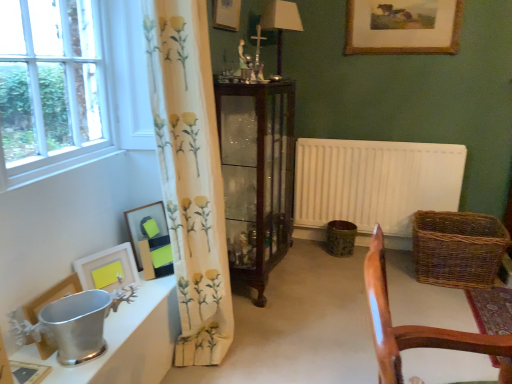
This screenshot has height=384, width=512. Describe the element at coordinates (51, 296) in the screenshot. I see `metallic silver picture frame at lower left, the fifth picture frame when ordered from right to left` at that location.

This screenshot has width=512, height=384. Find the location of `metallic silver picture frame at lower left, which is counted as the second picture frame, starting from the bottom`. metallic silver picture frame at lower left, which is counted as the second picture frame, starting from the bottom is located at coordinates (51, 296).

The height and width of the screenshot is (384, 512). What do you see at coordinates (127, 341) in the screenshot?
I see `polished silver bucket at lower left` at bounding box center [127, 341].

What is the approximate width of gold-framed painting at upper center, which is counted as the 6th picture frame, starting from the bottom?

It is 2.55 inches.

The width and height of the screenshot is (512, 384). What are the coordinates of `metallic silver picture frame at lower left, acting as the 5th picture frame starting from the top` in the screenshot? It's located at point(51,296).

Based on their positions, is brown woven basket at lower right located to the left or right of dark wood cabinet at center?

brown woven basket at lower right is to the right of dark wood cabinet at center.

Considering the points (485, 258) and (268, 217), which point is behind, point (485, 258) or point (268, 217)?

The point (485, 258) is behind.

Which object is thinner, brown woven basket at lower right or dark wood cabinet at center?

dark wood cabinet at center.

Is yellow floral fabric curtain at left a part of gold-framed painting at upper center, which is counted as the first picture frame, starting from the top?

Definitely not — yellow floral fabric curtain at left is not inside gold-framed painting at upper center, which is counted as the first picture frame, starting from the top.

Based on the photo, can you confirm if gold-framed painting at upper center, which is counted as the first picture frame, starting from the top, is smaller than yellow floral fabric curtain at left?

Yes.

What's the angular difference between gold-framed painting at upper center, placed as the 1th picture frame when sorted from right to left, and yellow floral fabric curtain at left's facing directions?

There is a 89.6-degree angle between the facing directions of gold-framed painting at upper center, placed as the 1th picture frame when sorted from right to left, and yellow floral fabric curtain at left.

Which is more distant, (425, 23) or (207, 256)?

Positioned behind is point (425, 23).

Consider the image. Is white matte radiator at center right further to the viewer compared to wooden chair at lower right?

Yes, white matte radiator at center right is further from the camera.

Considering the sizes of white matte radiator at center right and wooden chair at lower right in the image, is white matte radiator at center right taller or shorter than wooden chair at lower right?

white matte radiator at center right is taller than wooden chair at lower right.

In the scene shown: Would you say white matte radiator at center right is to the left or to the right of wooden chair at lower right in the picture?

Clearly, white matte radiator at center right is on the right of wooden chair at lower right in the image.

Considering the points (426, 175) and (369, 283), which point is in front, point (426, 175) or point (369, 283)?

The point (369, 283) is in front.

Where is `picture frame that is the 3rd one when counting leftward from the brown woven basket at lower right`? The image size is (512, 384). picture frame that is the 3rd one when counting leftward from the brown woven basket at lower right is located at coordinates (150, 240).

Which is in front, brown woven basket at lower right or matte black picture frame at lower left, which is the 3th picture frame from top to bottom?

Positioned in front is matte black picture frame at lower left, which is the 3th picture frame from top to bottom.

Does brown woven basket at lower right have a lesser width compared to matte black picture frame at lower left, which ranks as the 4th picture frame in bottom-to-top order?

Incorrect, the width of brown woven basket at lower right is not less than that of matte black picture frame at lower left, which ranks as the 4th picture frame in bottom-to-top order.

Considering the sizes of metallic silver picture frame at lower left, acting as the fifth picture frame starting from the back, and white matte radiator at center right in the image, is metallic silver picture frame at lower left, acting as the fifth picture frame starting from the back, taller or shorter than white matte radiator at center right?

In the image, metallic silver picture frame at lower left, acting as the fifth picture frame starting from the back, appears to be shorter than white matte radiator at center right.

Is metallic silver picture frame at lower left, arranged as the 2th picture frame when viewed from the front, beside white matte radiator at center right?

No, metallic silver picture frame at lower left, arranged as the 2th picture frame when viewed from the front, is not touching white matte radiator at center right.

Based on the photo, which object is closer to the camera, metallic silver picture frame at lower left, the fifth picture frame when ordered from right to left, or white matte radiator at center right?

metallic silver picture frame at lower left, the fifth picture frame when ordered from right to left.

Is matte white lampshade at upper center completely or partially inside brown woven basket at lower right?

No, brown woven basket at lower right does not contain matte white lampshade at upper center.

Can you confirm if brown woven basket at lower right is smaller than matte white lampshade at upper center?

Actually, brown woven basket at lower right might be larger than matte white lampshade at upper center.

From their relative heights in the image, would you say matte black picture frame at lower left, which is the 3th picture frame from top to bottom, is taller or shorter than matte white lampshade at upper center?

In the image, matte black picture frame at lower left, which is the 3th picture frame from top to bottom, appears to be shorter than matte white lampshade at upper center.

Which is closer, (155, 229) or (280, 67)?

Point (155, 229) appears to be closer to the viewer than point (280, 67).

Where is `table lamp behind the matte black picture frame at lower left, acting as the third picture frame starting from the right`? The image size is (512, 384). table lamp behind the matte black picture frame at lower left, acting as the third picture frame starting from the right is located at coordinates 280,22.

Considering the relative sizes of matte black picture frame at lower left, acting as the third picture frame starting from the right, and matte white lampshade at upper center in the image provided, is matte black picture frame at lower left, acting as the third picture frame starting from the right, thinner than matte white lampshade at upper center?

Yes, matte black picture frame at lower left, acting as the third picture frame starting from the right, is thinner than matte white lampshade at upper center.

This screenshot has height=384, width=512. Find the location of `basket below the dark wood cabinet at center (from the image's perspective)`. basket below the dark wood cabinet at center (from the image's perspective) is located at coordinates (458, 248).

Starting from the yellow floral fabric curtain at left, which picture frame is the 4th one behind? Please provide its 2D coordinates.

[(402, 26)]

Estimate the real-world distances between objects in this image. Which object is further from brown woven basket at lower right, wooden picture frame at lower left, which appears as the first picture frame when ordered from the bottom, or wooden chair at lower right?

wooden picture frame at lower left, which appears as the first picture frame when ordered from the bottom, is further to brown woven basket at lower right.

Looking at the image, which one is located further to wooden picture frame at lower left, which appears as the first picture frame when viewed from the front, wooden chair at lower right or matte black picture frame at lower left, which is the 3th picture frame from top to bottom?

wooden chair at lower right lies further to wooden picture frame at lower left, which appears as the first picture frame when viewed from the front, than the other object.

Considering their positions, is white matte picture frame at lower left, the third picture frame viewed from the front, positioned further to clear glass window at left than matte wooden picture frame at upper center, which ranks as the second picture frame in back-to-front order?

matte wooden picture frame at upper center, which ranks as the second picture frame in back-to-front order, lies further to clear glass window at left than the other object.

When comparing their distances from matte wooden picture frame at upper center, the fifth picture frame viewed from the left, does matte black picture frame at lower left, which is the 3th picture frame from top to bottom, or wooden picture frame at lower left, which appears as the first picture frame when ordered from the bottom, seem further?

wooden picture frame at lower left, which appears as the first picture frame when ordered from the bottom, is further to matte wooden picture frame at upper center, the fifth picture frame viewed from the left.

Which object lies further to the anchor point wooden picture frame at lower left, the 1th picture frame viewed from the left, polished silver bucket at lower left or matte wooden picture frame at upper center, the fifth picture frame viewed from the left?

Among the two, matte wooden picture frame at upper center, the fifth picture frame viewed from the left, is located further to wooden picture frame at lower left, the 1th picture frame viewed from the left.

When comparing their distances from matte white lampshade at upper center, does white matte picture frame at lower left, the third picture frame viewed from the front, or brown woven basket at lower right seem further?

Among the two, white matte picture frame at lower left, the third picture frame viewed from the front, is located further to matte white lampshade at upper center.

Considering their positions, is clear glass window at left positioned closer to matte black picture frame at lower left, which ranks as the 4th picture frame in bottom-to-top order, than metallic silver picture frame at lower left, acting as the fifth picture frame starting from the back?

metallic silver picture frame at lower left, acting as the fifth picture frame starting from the back, is closer to matte black picture frame at lower left, which ranks as the 4th picture frame in bottom-to-top order.

Based on their spatial positions, is wooden picture frame at lower left, which is the 6th picture frame in right-to-left order, or polished silver bucket at lower left further from yellow floral fabric curtain at left?

The object further to yellow floral fabric curtain at left is wooden picture frame at lower left, which is the 6th picture frame in right-to-left order.

Locate an element on the screen. The width and height of the screenshot is (512, 384). curtain positioned between wooden picture frame at lower left, the 1th picture frame viewed from the left, and matte black picture frame at lower left, which ranks as the 4th picture frame in bottom-to-top order, from near to far is located at coordinates pyautogui.click(x=190, y=174).

Locate an element on the screen. The height and width of the screenshot is (384, 512). window between wooden chair at lower right and brown woven basket at lower right in the front-back direction is located at coordinates (78, 99).

Where is `cabinetry between clear glass window at left and white matte radiator at center right along the z-axis`? This screenshot has height=384, width=512. cabinetry between clear glass window at left and white matte radiator at center right along the z-axis is located at coordinates (257, 175).

The image size is (512, 384). What are the coordinates of `curtain between white matte picture frame at lower left, the third picture frame viewed from the front, and brown woven basket at lower right` in the screenshot? It's located at (190, 174).